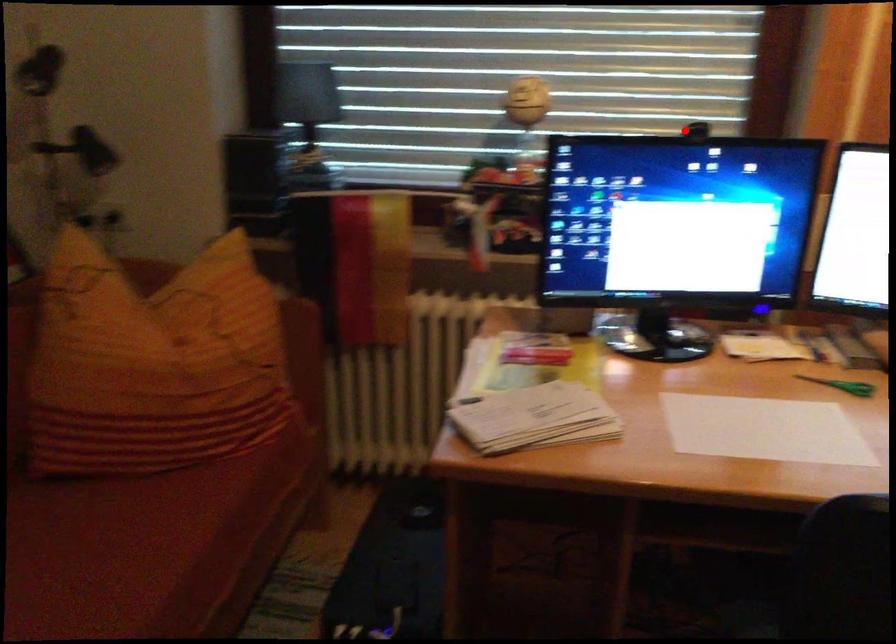
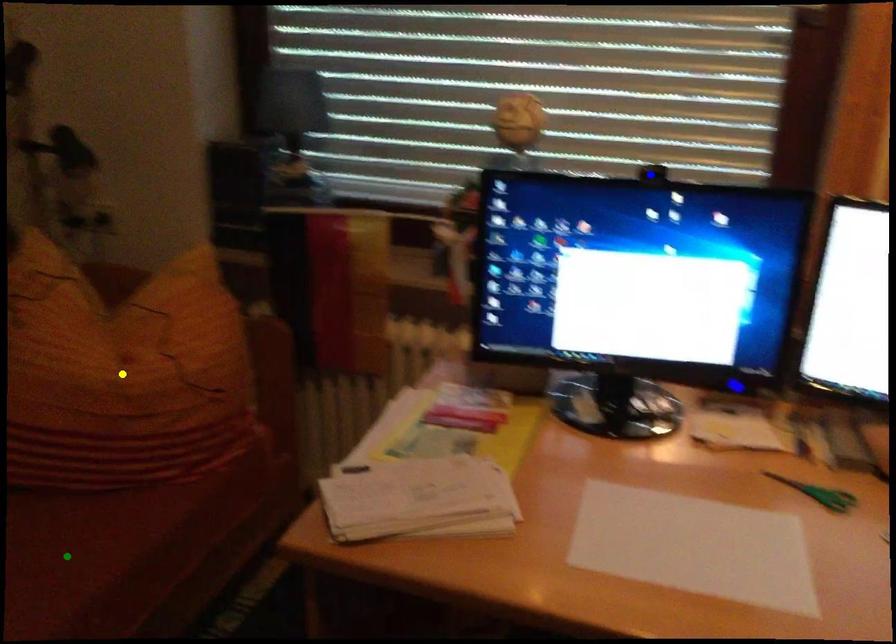
Question: I am providing you with two images of the same scene from different viewpoints. A red point is marked on the first image. You are given multiple points on the second image. Which mark in image 2 goes with the point in image 1?

Choices:
 (A) blue point
 (B) yellow point
 (C) green point

Answer: (A)